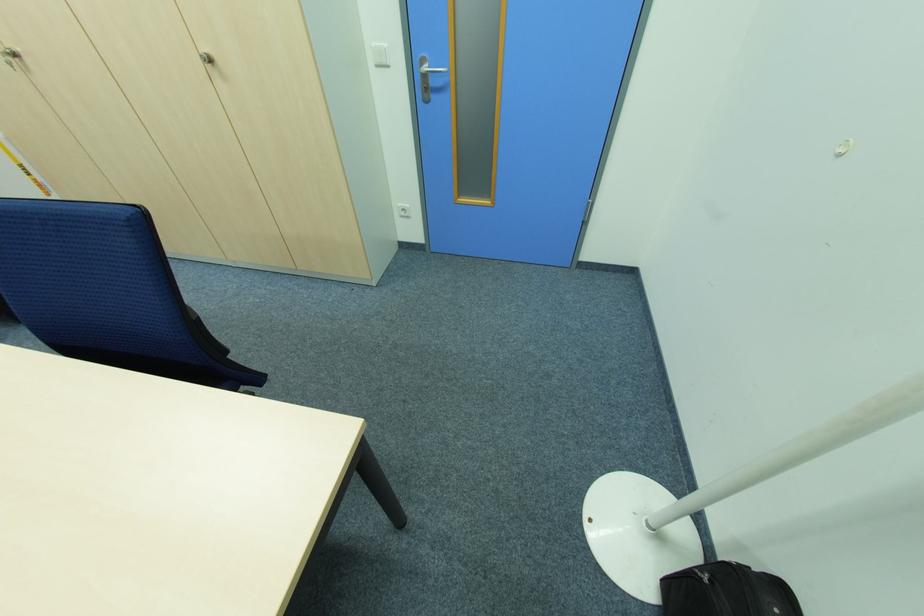
What do you see at coordinates (427, 76) in the screenshot? This screenshot has width=924, height=616. I see `the silver door handle` at bounding box center [427, 76].